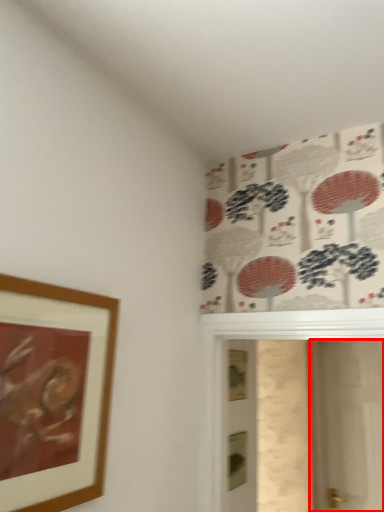
Question: Considering the relative positions of screen door (annotated by the red box) and picture frame in the image provided, where is screen door (annotated by the red box) located with respect to the staircase?

Choices:
 (A) left
 (B) right

Answer: (B)